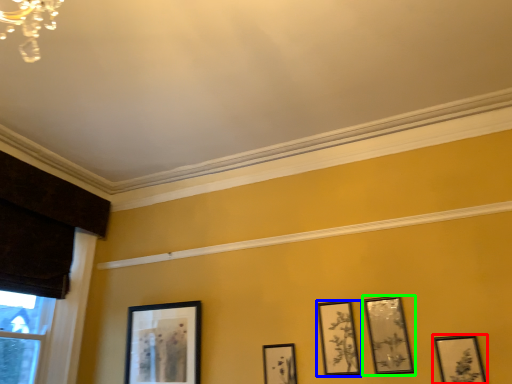
Question: Based on their relative distances, which object is nearer to picture frame (highlighted by a red box)? Choose from picture frame (highlighted by a blue box) and picture frame (highlighted by a green box).

Choices:
 (A) picture frame
 (B) picture frame

Answer: (B)